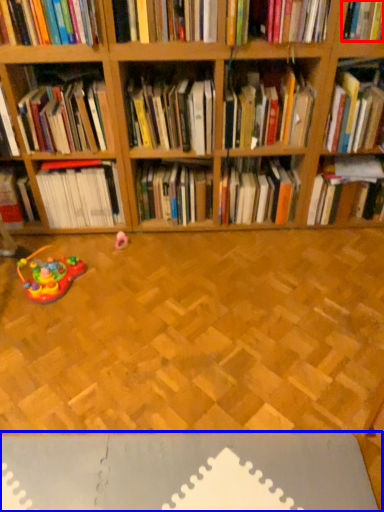
Question: Which point is further to the camera, book (highlighted by a red box) or surface (highlighted by a blue box)?

Choices:
 (A) book
 (B) surface

Answer: (A)